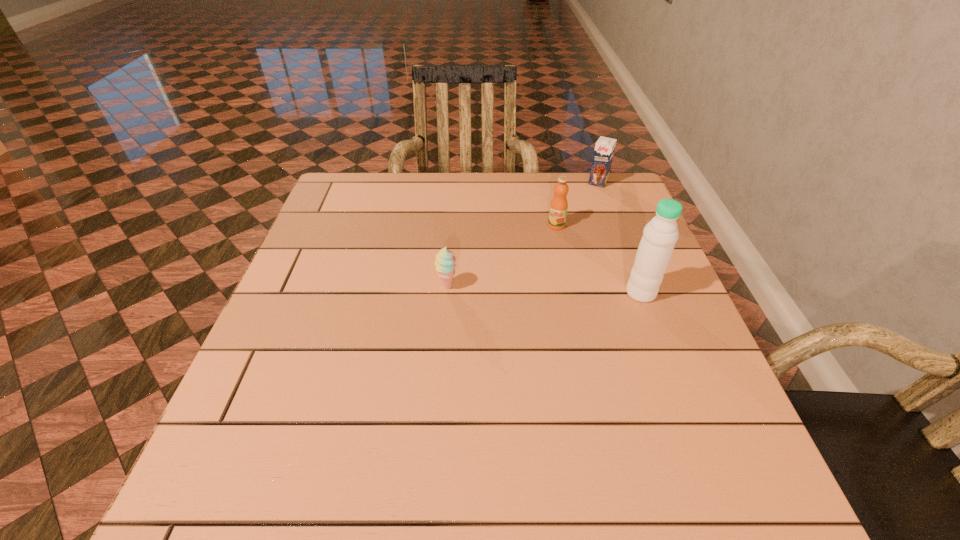
The image size is (960, 540). Identify the location of vacant space on the desktop that is between the sherbert and the water bottle and is positioned on the front label of the orange juice. (x=515, y=288).

The width and height of the screenshot is (960, 540). I want to click on vacant spot on the desktop that is between the shortest object and the tallest object and is positioned on the front label of the chocolate milk, so click(532, 289).